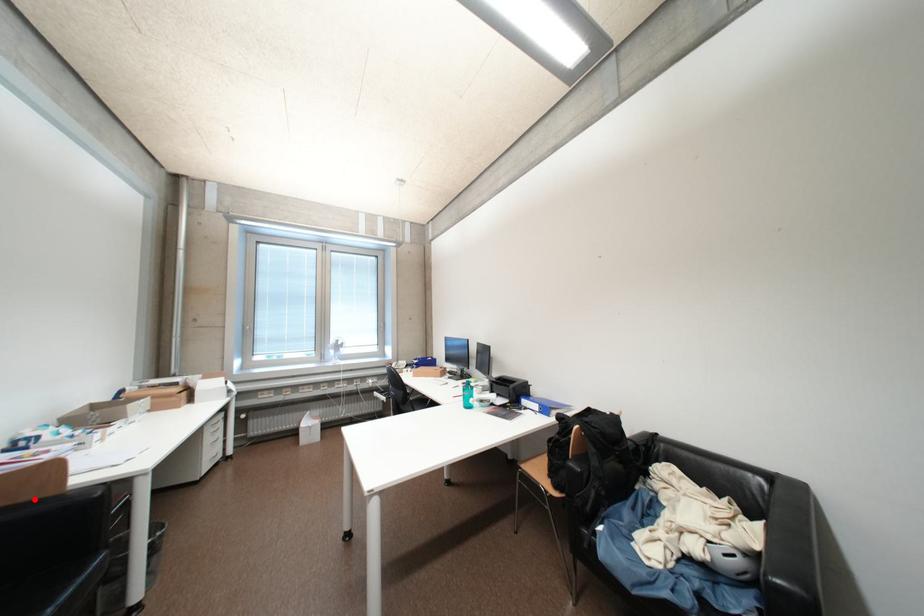
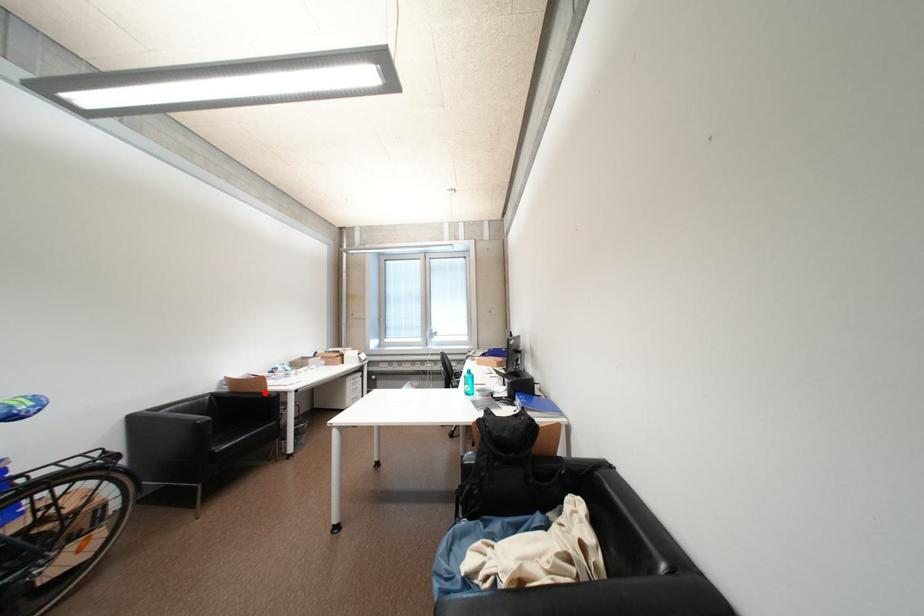
I am providing you with two images of the same scene from different viewpoints. A red point is marked on the first image and another point is marked on the second image. Is the red point in image1 aligned with the point shown in image2?

Yes